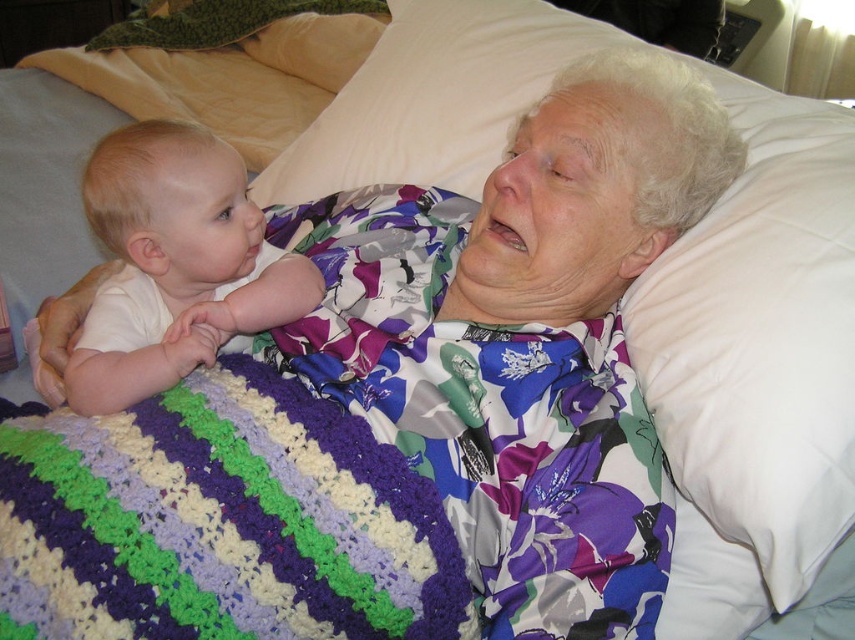
Question: Where is multicolored crocheted blanket at lower left located in relation to white smooth baby at left in the image?

Choices:
 (A) above
 (B) below

Answer: (B)

Question: Which point is farther to the camera?

Choices:
 (A) white smooth baby at left
 (B) multicolored crocheted blanket at lower left

Answer: (A)

Question: Is the position of multicolored crocheted blanket at lower left more distant than that of white smooth baby at left?

Choices:
 (A) no
 (B) yes

Answer: (A)

Question: Does multicolored crocheted blanket at lower left appear on the left side of white smooth baby at left?

Choices:
 (A) no
 (B) yes

Answer: (A)

Question: Among these objects, which one is farthest from the camera?

Choices:
 (A) multicolored crocheted blanket at lower left
 (B) white smooth baby at left

Answer: (B)